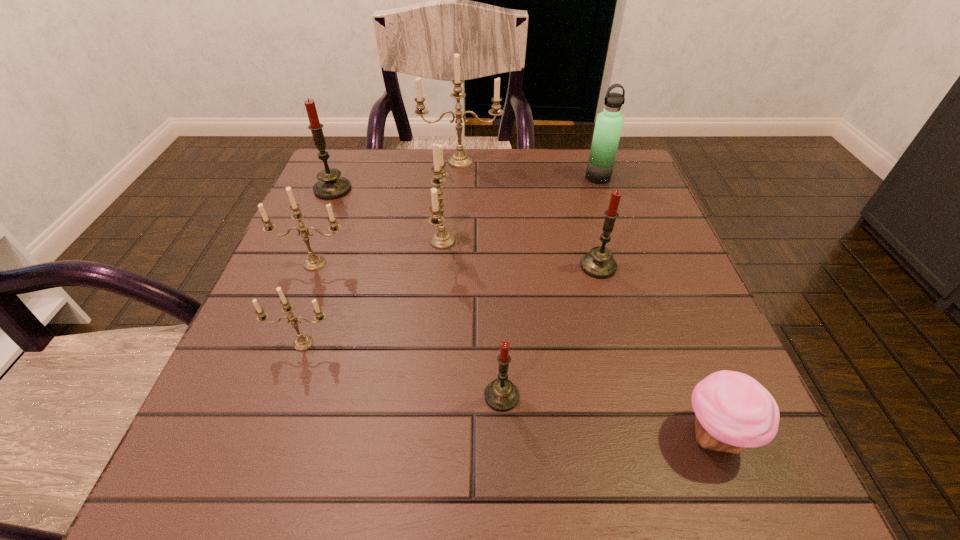
Identify the location of vacant space situated on the front of the second smallest metallic candle. (285, 341).

I want to click on free location located on the back of the second red candle from left to right, so click(496, 256).

I want to click on free space located 0.060m on the right of the smallest metallic candle, so click(x=372, y=343).

You are a GUI agent. You are given a task and a screenshot of the screen. Output one action in this format:
    pyautogui.click(x=<x>, y=<y>)
    Task: Click on the vacant area situated 0.120m on the back of the shortest object
    
    Given the screenshot: What is the action you would take?
    pyautogui.click(x=677, y=339)

The height and width of the screenshot is (540, 960). Find the location of `thermos bottle that is at the far edge`. thermos bottle that is at the far edge is located at coordinates (609, 123).

The image size is (960, 540). I want to click on object that is at the near edge, so click(733, 411).

This screenshot has height=540, width=960. In order to click on thermos bottle at the right edge in this screenshot , I will do `click(609, 123)`.

Where is `candle that is at the right edge`? The image size is (960, 540). candle that is at the right edge is located at coordinates (599, 263).

Find the location of a particular element. This screenshot has width=960, height=540. cupcake present at the right edge is located at coordinates (733, 411).

The image size is (960, 540). Identify the location of object that is at the far left corner. (330, 186).